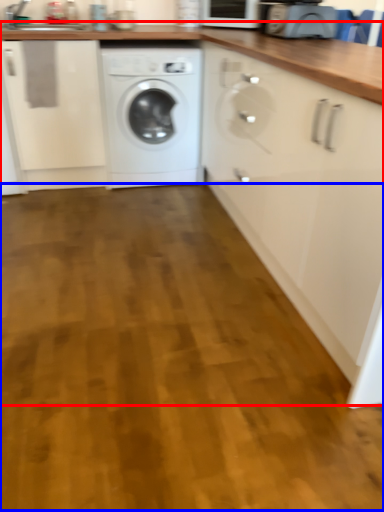
Question: Which object is further to the camera taking this photo, counter (highlighted by a red box) or plain (highlighted by a blue box)?

Choices:
 (A) counter
 (B) plain

Answer: (B)